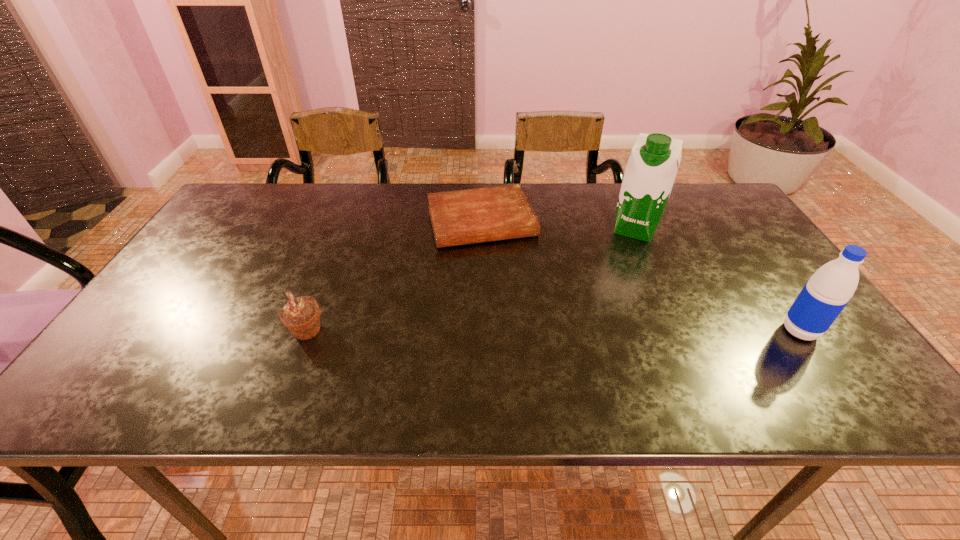
At what (x,y) coordinates should I click in order to perform the action: click on vacant space located 0.350m on the front-facing side of the soya milk. Please return your answer as a coordinate pair (x, y). This screenshot has height=540, width=960. Looking at the image, I should click on (599, 326).

The image size is (960, 540). I want to click on free region located 0.370m on the front-facing side of the soya milk, so click(x=597, y=333).

Locate an element on the screen. This screenshot has width=960, height=540. blank space located on the front-facing side of the soya milk is located at coordinates (616, 279).

Where is `free point located 0.130m on the spine side of the Bible`? The image size is (960, 540). free point located 0.130m on the spine side of the Bible is located at coordinates (504, 281).

Identify the location of vacant area located 0.270m on the spine side of the Bible. (518, 321).

This screenshot has width=960, height=540. I want to click on free location located on the spine side of the Bible, so click(x=518, y=321).

Where is `soya milk that is positioned at the far edge`? Image resolution: width=960 pixels, height=540 pixels. soya milk that is positioned at the far edge is located at coordinates (651, 170).

This screenshot has height=540, width=960. Find the location of `Bible located at the far edge`. Bible located at the far edge is located at coordinates (460, 217).

Locate an element on the screen. muffin situated at the near edge is located at coordinates (301, 315).

Identify the location of water bottle located at the near edge. (825, 295).